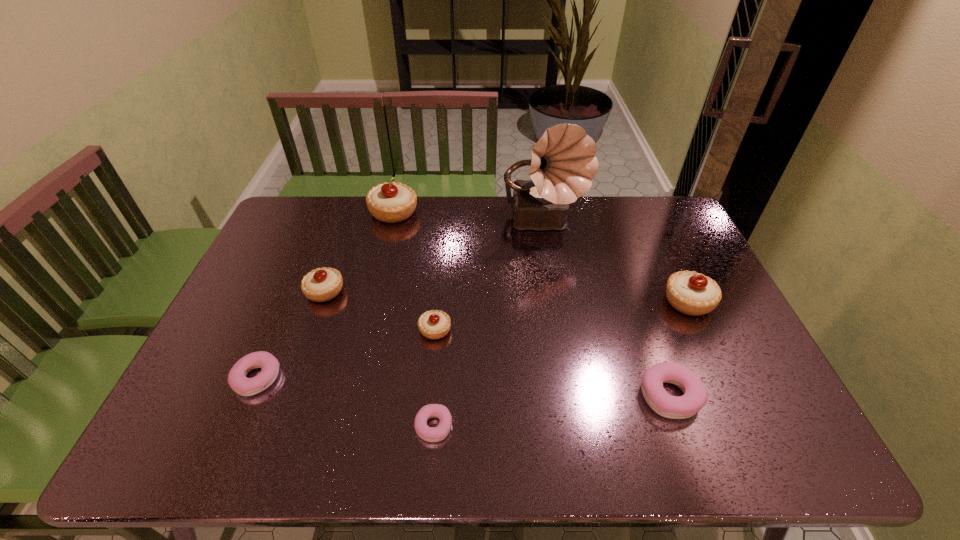
At what (x,y) coordinates should I click in order to perform the action: click on free location located 0.150m on the front of the third beige pastry from left to right. Please return your answer as a coordinate pair (x, y). The image size is (960, 540). Looking at the image, I should click on (429, 392).

Find the location of `vacant space situated 0.370m on the back of the second object from right to left`. vacant space situated 0.370m on the back of the second object from right to left is located at coordinates (627, 271).

The height and width of the screenshot is (540, 960). Identify the location of vacant space located 0.080m on the back of the second shortest pastry. (276, 334).

Locate an element on the screen. The image size is (960, 540). vacant region located 0.320m on the back of the smallest pink pastry is located at coordinates (444, 308).

Find the location of a particular element. Image resolution: width=960 pixels, height=540 pixels. record player at the far edge is located at coordinates (563, 162).

The image size is (960, 540). I want to click on pastry situated at the far edge, so click(x=391, y=202).

This screenshot has height=540, width=960. I want to click on object located at the near edge, so click(x=431, y=434).

Find the location of a particular element. Image resolution: width=960 pixels, height=540 pixels. object at the left edge is located at coordinates (269, 365).

Locate an element on the screen. object positioned at the right edge is located at coordinates (692, 293).

In order to click on free space at the far edge of the desktop in this screenshot , I will do `click(425, 202)`.